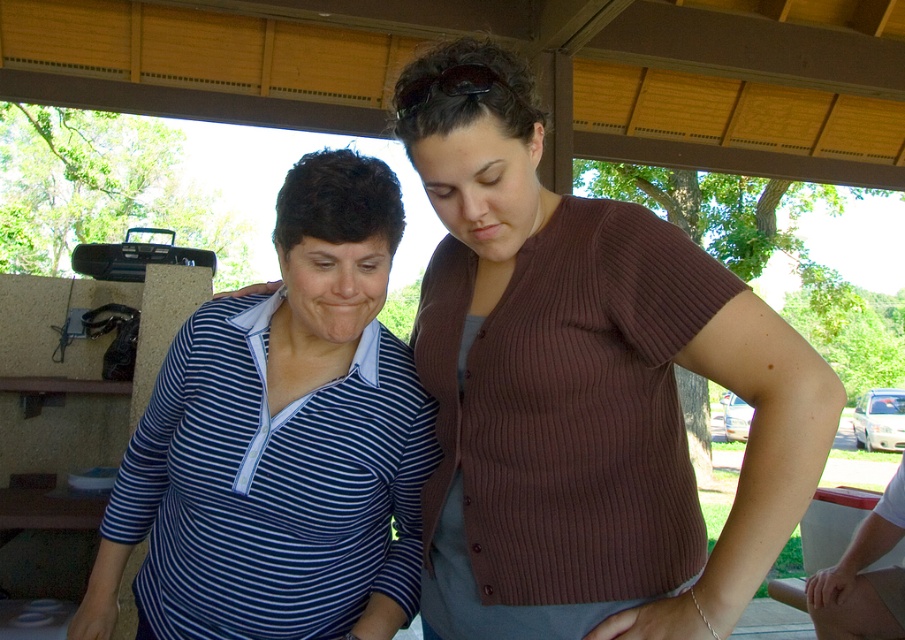
This screenshot has width=905, height=640. Describe the element at coordinates (583, 388) in the screenshot. I see `striped knit sweater at center` at that location.

Which is more to the left, striped knit sweater at center or blue striped shirt at center?

blue striped shirt at center

Where is `striped knit sweater at center`? striped knit sweater at center is located at coordinates click(583, 388).